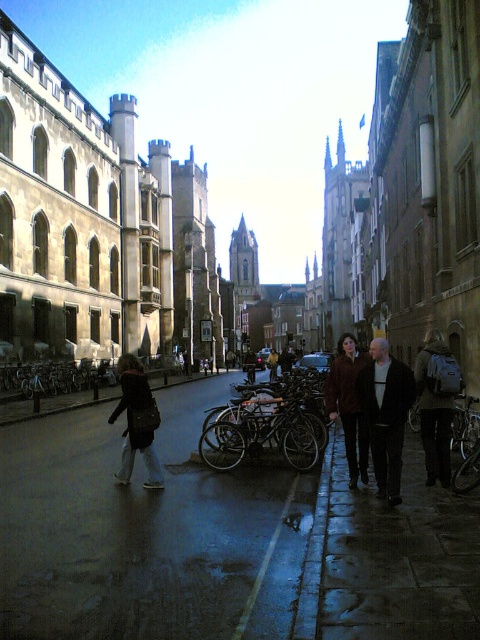
Which is more to the right, dark gray stone pavement at lower right or brown leather jacket at center?

dark gray stone pavement at lower right is more to the right.

Who is more forward, (x=454, y=620) or (x=358, y=360)?

Point (x=454, y=620) is in front.

Describe the element at coordinates (399, 560) in the screenshot. Image resolution: width=480 pixels, height=640 pixels. I see `dark gray stone pavement at lower right` at that location.

You are a GUI agent. You are given a task and a screenshot of the screen. Output one action in this format:
    pyautogui.click(x=<x>, y=<y>)
    Task: Click on the dark gray stone pavement at lower right
    
    Given the screenshot: What is the action you would take?
    pyautogui.click(x=399, y=560)

Does dark brown leather jacket at center appear on the right side of brown leather jacket at center?

Indeed, dark brown leather jacket at center is positioned on the right side of brown leather jacket at center.

Is dark brown leather jacket at center taller than brown leather jacket at center?

In fact, dark brown leather jacket at center may be shorter than brown leather jacket at center.

Is point (370, 428) in front of point (351, 365)?

Yes, it is.

You are a GUI agent. You are given a task and a screenshot of the screen. Output one action in this format:
    pyautogui.click(x=<x>, y=<y>)
    Task: Click on the dark brown leather jacket at center
    Image resolution: width=480 pixels, height=640 pixels.
    Given the screenshot: What is the action you would take?
    pyautogui.click(x=385, y=413)

Looking at this image, between shiny metallic bicycles at center and brown leather jacket at center, which one has more height?

Standing taller between the two is brown leather jacket at center.

Which of these two, shiny metallic bicycles at center or brown leather jacket at center, stands shorter?

shiny metallic bicycles at center

I want to click on shiny metallic bicycles at center, so click(263, 433).